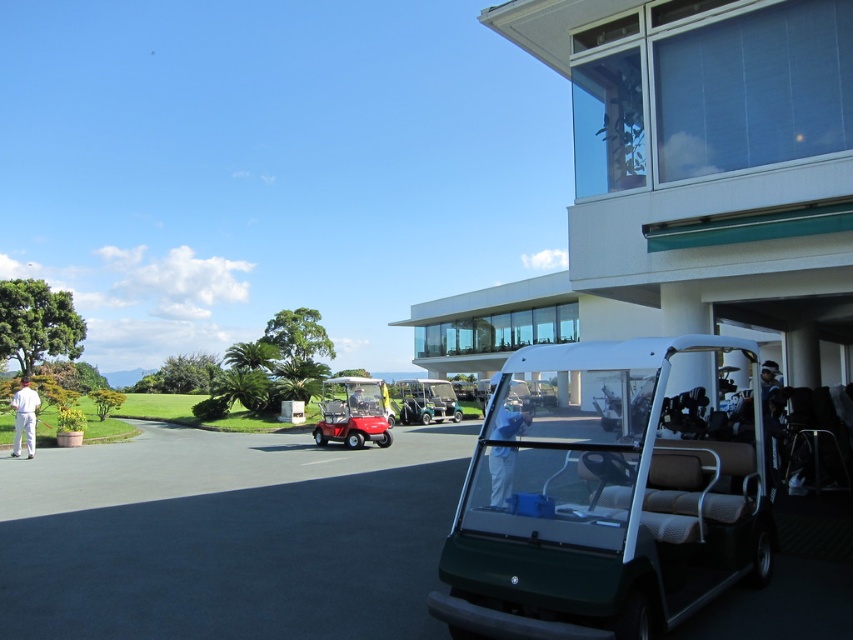
Question: Does blue fabric person at center have a smaller size compared to white cotton pants at lower left?

Choices:
 (A) yes
 (B) no

Answer: (B)

Question: Considering the relative positions of green matte golf cart at center and blue fabric person at center in the image provided, where is green matte golf cart at center located with respect to blue fabric person at center?

Choices:
 (A) below
 (B) above

Answer: (B)

Question: Which of the following is the closest to the observer?

Choices:
 (A) green plastic golf cart at center
 (B) matte red golf cart at center
 (C) green matte golf cart at center
 (D) white cotton pants at lower left

Answer: (C)

Question: Among these points, which one is nearest to the camera?

Choices:
 (A) (33, 410)
 (B) (514, 458)

Answer: (B)

Question: Is matte red golf cart at center closer to camera compared to blue fabric person at center?

Choices:
 (A) yes
 (B) no

Answer: (B)

Question: Based on their relative distances, which object is farther from the matte red golf cart at center?

Choices:
 (A) white cotton pants at lower left
 (B) green matte golf cart at center
 (C) blue fabric person at center

Answer: (C)